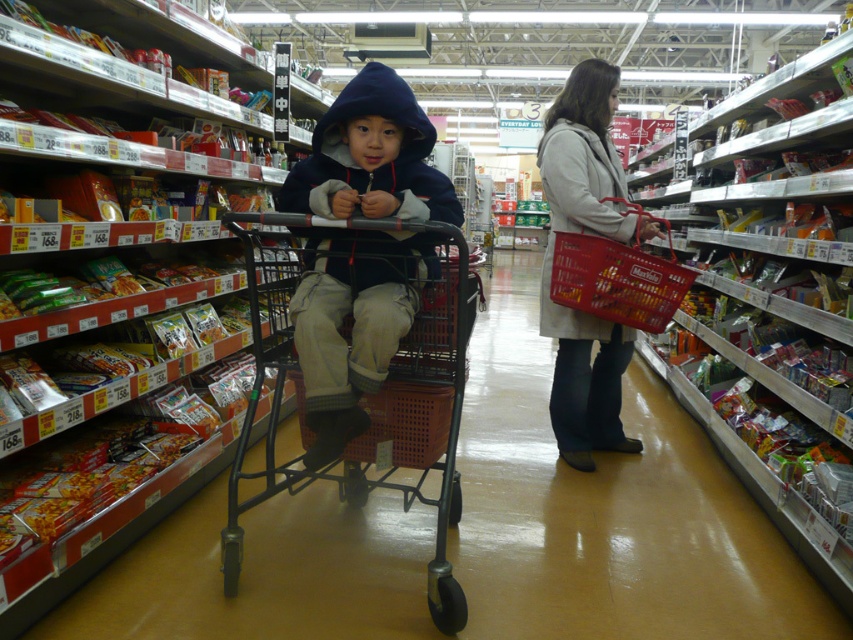
Question: Is dark blue fleece jacket at center closer to camera compared to gray wool coat at center?

Choices:
 (A) yes
 (B) no

Answer: (A)

Question: Which is farther from the dark blue fleece jacket at center?

Choices:
 (A) metallic shopping cart at center
 (B) gray wool coat at center

Answer: (B)

Question: Does dark blue fleece jacket at center appear on the left side of gray wool coat at center?

Choices:
 (A) no
 (B) yes

Answer: (B)

Question: Does dark blue fleece jacket at center appear on the left side of gray wool coat at center?

Choices:
 (A) yes
 (B) no

Answer: (A)

Question: Which object appears farthest from the camera in this image?

Choices:
 (A) gray wool coat at center
 (B) dark blue fleece jacket at center
 (C) metallic shopping cart at center

Answer: (A)

Question: Which point is farther to the camera?

Choices:
 (A) (311, 406)
 (B) (566, 314)

Answer: (B)